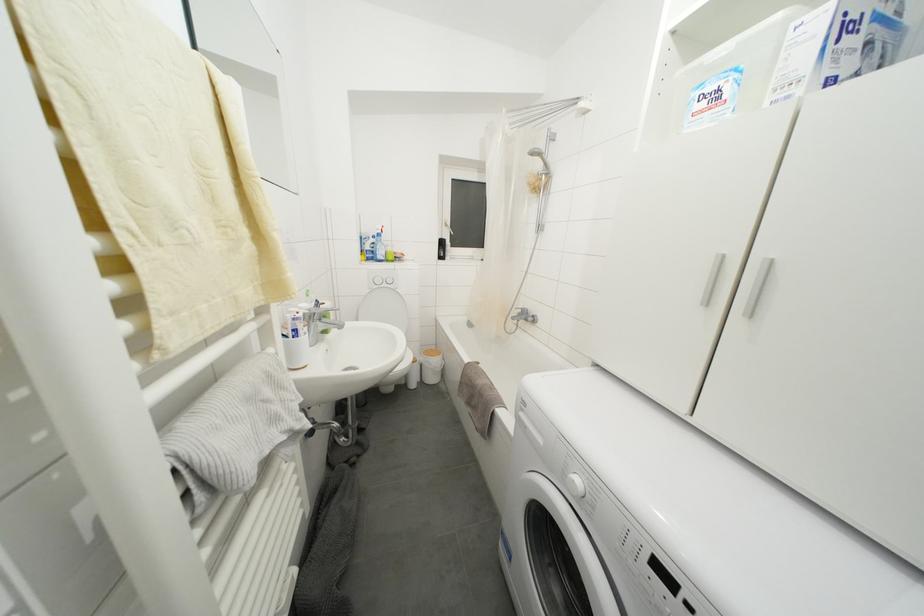
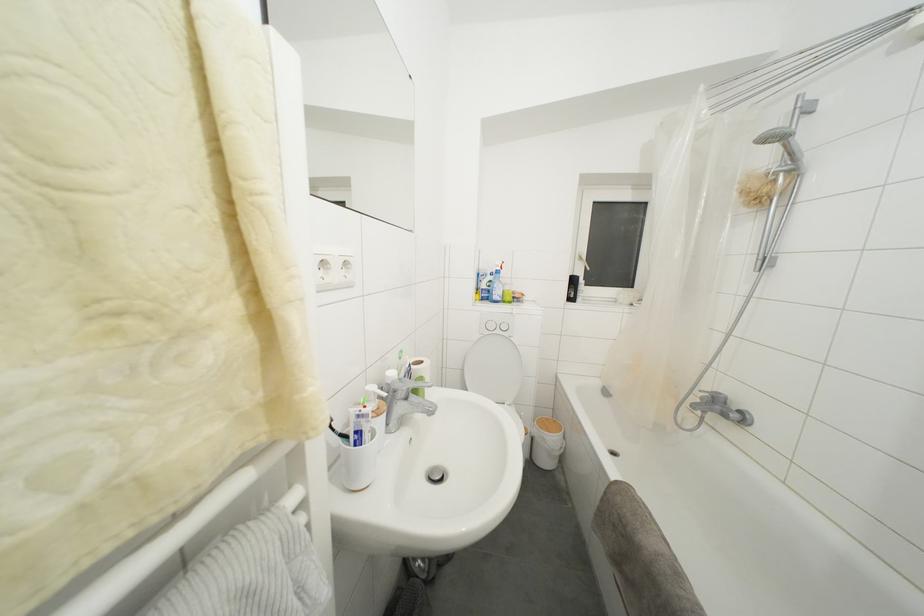
The point at [445,248] is marked in the first image. Where is the corresponding point in the second image?

(578, 286)